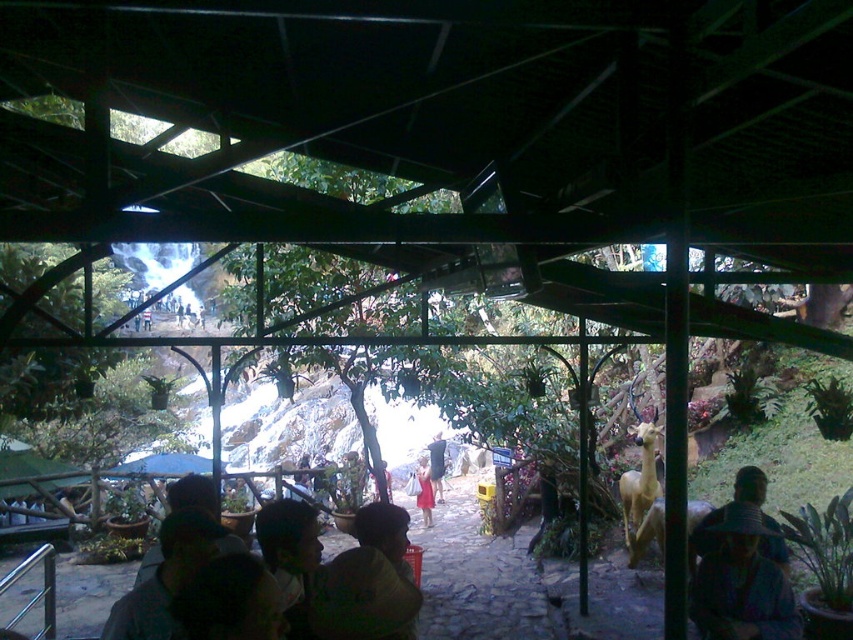
The width and height of the screenshot is (853, 640). What do you see at coordinates (172, 561) in the screenshot? I see `dark green fabric hat at lower center` at bounding box center [172, 561].

Is dark green fabric hat at lower center to the left of red fabric dress at center from the viewer's perspective?

Indeed, dark green fabric hat at lower center is positioned on the left side of red fabric dress at center.

Between point (170, 515) and point (431, 509), which one is positioned in front?

Point (170, 515) is in front.

Where is `dark green fabric hat at lower center`? dark green fabric hat at lower center is located at coordinates (172, 561).

Who is lower down, dark green fabric hat at lower center or matte black hat at lower right?

matte black hat at lower right is below.

Who is more distant from viewer, (369, 600) or (738, 518)?

The point (738, 518) is more distant.

Which is in front, point (155, 592) or point (724, 566)?

Point (155, 592)

Image resolution: width=853 pixels, height=640 pixels. I want to click on dark green fabric hat at lower center, so click(x=172, y=561).

Does dark gray fabric hat at lower right have a greater width compared to matte red dress at center?

Correct, the width of dark gray fabric hat at lower right exceeds that of matte red dress at center.

What do you see at coordinates (704, 536) in the screenshot? I see `dark gray fabric hat at lower right` at bounding box center [704, 536].

You are a GUI agent. You are given a task and a screenshot of the screen. Output one action in this format:
    pyautogui.click(x=<x>, y=<y>)
    Task: Click on the dark gray fabric hat at lower right
    The image size is (853, 640).
    Given the screenshot: What is the action you would take?
    pyautogui.click(x=704, y=536)